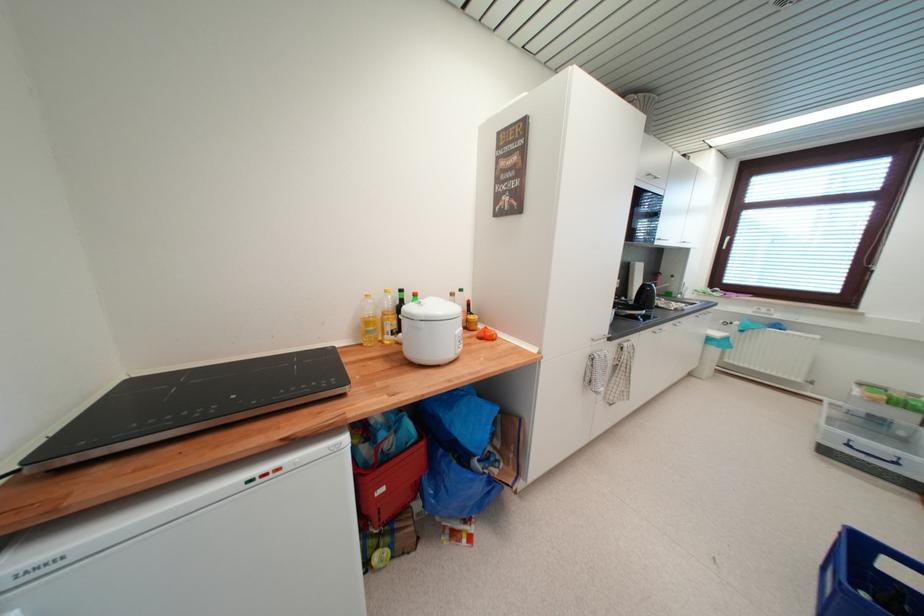
The height and width of the screenshot is (616, 924). What do you see at coordinates (871, 454) in the screenshot?
I see `a clear box handle` at bounding box center [871, 454].